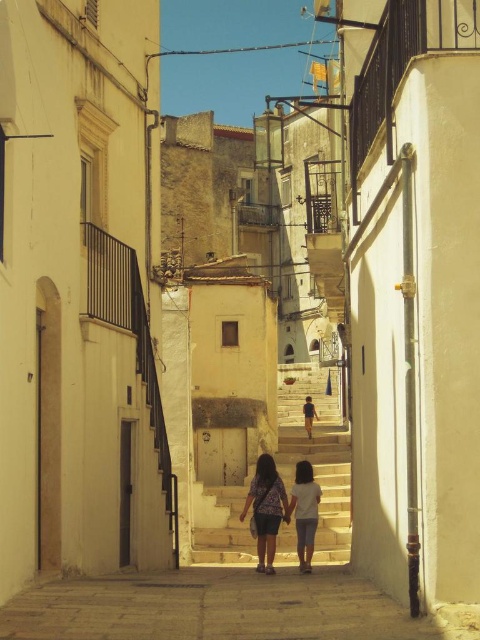
Question: Estimate the real-world distances between objects in this image. Which object is farther from the light blue denim shorts at center?

Choices:
 (A) light brown fabric dress at center
 (B) light beige stone stairs at center

Answer: (A)

Question: Is light blue denim jeans at center thinner than light blue denim shorts at center?

Choices:
 (A) no
 (B) yes

Answer: (B)

Question: Does light blue denim jeans at center have a larger size compared to light blue denim shorts at center?

Choices:
 (A) yes
 (B) no

Answer: (A)

Question: Among these points, which one is farthest from the camera?

Choices:
 (A) (296, 502)
 (B) (273, 476)
 (C) (195, 531)

Answer: (C)

Question: Can you confirm if light beige stone stairs at center is thinner than light blue denim jeans at center?

Choices:
 (A) yes
 (B) no

Answer: (B)

Question: Which point appears farthest from the camera in this image?

Choices:
 (A) (312, 428)
 (B) (251, 500)

Answer: (A)